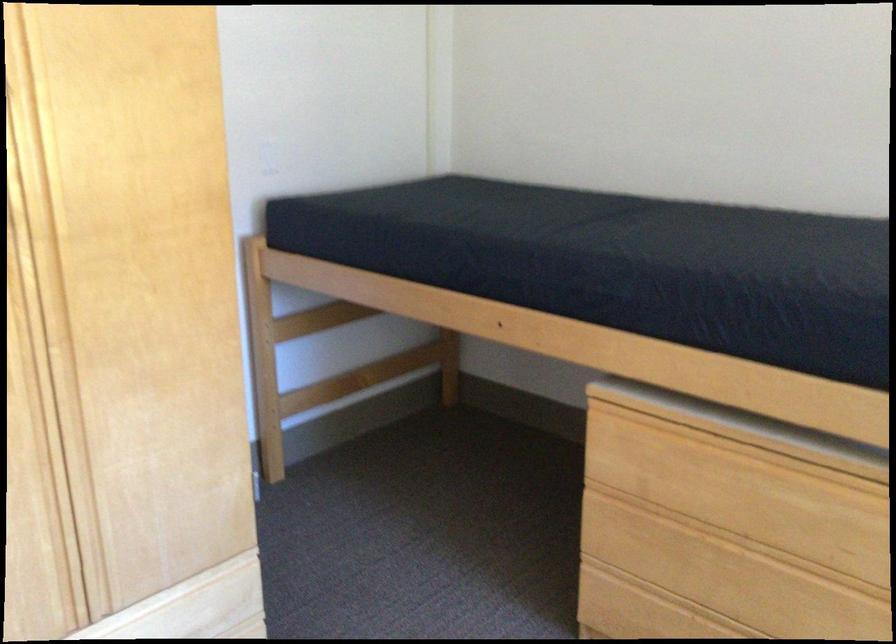
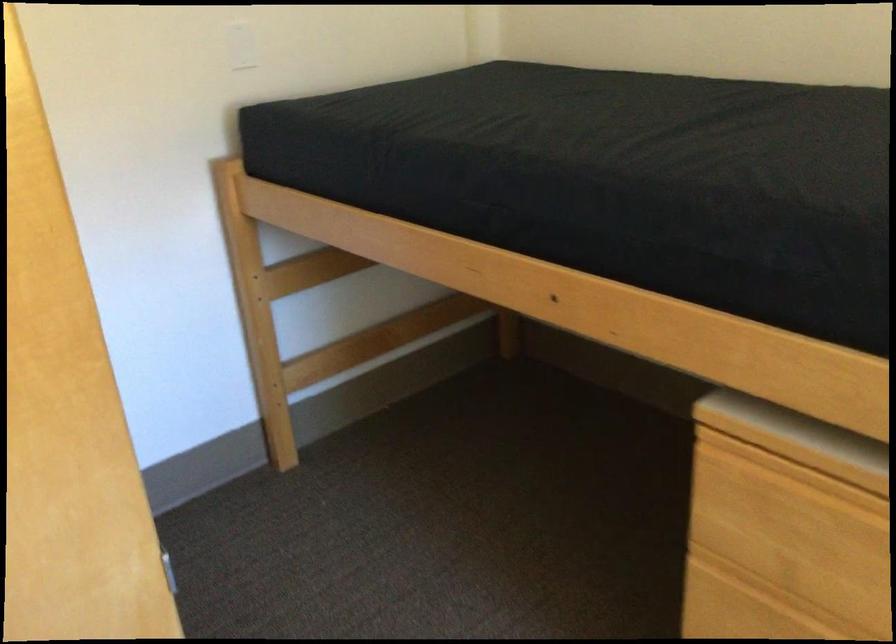
Find the pixel in the second image that matches (x=266, y=151) in the first image.

(239, 44)